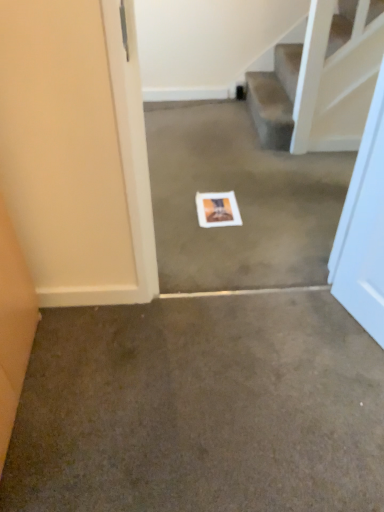
The image size is (384, 512). Describe the element at coordinates (200, 409) in the screenshot. I see `brown carpet at center, the 1th concrete from the bottom` at that location.

At what (x,y) coordinates should I click in order to perform the action: click on brown carpet at center, the 1th concrete viewed from the front. Please return your answer as a coordinate pair (x, y). This screenshot has width=384, height=512. Looking at the image, I should click on (200, 409).

Which is more distant, (215, 206) or (324, 201)?

Positioned behind is point (324, 201).

Considering the positions of objects white matte postcard at center and white paper at center, which is the first concrete in top-to-bottom order, in the image provided, who is more to the right, white matte postcard at center or white paper at center, which is the first concrete in top-to-bottom order,?

white paper at center, which is the first concrete in top-to-bottom order, is more to the right.

Based on the photo, considering the sizes of objects white matte postcard at center and white paper at center, positioned as the first concrete in back-to-front order, in the image provided, who is thinner, white matte postcard at center or white paper at center, positioned as the first concrete in back-to-front order,?

With smaller width is white matte postcard at center.

Locate an element on the screen. This screenshot has height=512, width=384. postcard below the white paper at center, which is the first concrete in top-to-bottom order (from the image's perspective) is located at coordinates (217, 209).

Who is shorter, white paper at center, the second concrete when ordered from front to back, or brown carpet at center, the 1th concrete viewed from the front?

brown carpet at center, the 1th concrete viewed from the front.

Looking at this image, from the image's perspective, is white paper at center, positioned as the first concrete in back-to-front order, under brown carpet at center, the 1th concrete viewed from the front?

Actually, white paper at center, positioned as the first concrete in back-to-front order, appears above brown carpet at center, the 1th concrete viewed from the front, in the image.

Does white paper at center, the second concrete when ordered from front to back, have a greater width compared to brown carpet at center, the 1th concrete viewed from the front?

Indeed, white paper at center, the second concrete when ordered from front to back, has a greater width compared to brown carpet at center, the 1th concrete viewed from the front.

What's the angular difference between brown carpet at center, arranged as the 2th concrete when viewed from the back, and white matte postcard at center's facing directions?

There is a 179-degree angle between the facing directions of brown carpet at center, arranged as the 2th concrete when viewed from the back, and white matte postcard at center.

Is brown carpet at center, arranged as the 2th concrete when viewed from the back, with white matte postcard at center?

No, brown carpet at center, arranged as the 2th concrete when viewed from the back, is not in contact with white matte postcard at center.

Which of these two, brown carpet at center, placed as the second concrete when sorted from top to bottom, or white matte postcard at center, stands taller?

brown carpet at center, placed as the second concrete when sorted from top to bottom.

Is brown carpet at center, the 1th concrete viewed from the front, outside of white matte postcard at center?

Yes, brown carpet at center, the 1th concrete viewed from the front, is not within white matte postcard at center.

Which point is more distant from viewer, (x=221, y=194) or (x=57, y=452)?

Positioned behind is point (x=221, y=194).

Considering the relative positions of white matte postcard at center and brown carpet at center, the 1th concrete viewed from the front, in the image provided, is white matte postcard at center to the left of brown carpet at center, the 1th concrete viewed from the front, from the viewer's perspective?

No.

Is white matte postcard at center shorter than brown carpet at center, placed as the second concrete when sorted from top to bottom?

Indeed, white matte postcard at center has a lesser height compared to brown carpet at center, placed as the second concrete when sorted from top to bottom.

Considering the relative sizes of white matte postcard at center and brown carpet at center, arranged as the 2th concrete when viewed from the back, in the image provided, is white matte postcard at center smaller than brown carpet at center, arranged as the 2th concrete when viewed from the back,?

Yes.

From the image's perspective, between brown carpet at center, the 1th concrete viewed from the front, and white paper at center, positioned as the first concrete in back-to-front order, which one is located above?

white paper at center, positioned as the first concrete in back-to-front order, from the image's perspective.

Is point (353, 422) closer or farther from the camera than point (200, 132)?

Point (353, 422) is closer to the camera than point (200, 132).

Does brown carpet at center, the 1th concrete viewed from the front, contain white paper at center, positioned as the first concrete in back-to-front order?

No, white paper at center, positioned as the first concrete in back-to-front order, is not a part of brown carpet at center, the 1th concrete viewed from the front.

Is brown carpet at center, the 1th concrete viewed from the front, with white paper at center, positioned as the first concrete in back-to-front order?

No, brown carpet at center, the 1th concrete viewed from the front, is not with white paper at center, positioned as the first concrete in back-to-front order.

Considering the sizes of objects white paper at center, positioned as the first concrete in back-to-front order, and white matte postcard at center in the image provided, who is wider, white paper at center, positioned as the first concrete in back-to-front order, or white matte postcard at center?

white paper at center, positioned as the first concrete in back-to-front order.

Which is more to the left, white paper at center, positioned as the first concrete in back-to-front order, or white matte postcard at center?

Positioned to the left is white matte postcard at center.

From the image's perspective, is white paper at center, which is the first concrete in top-to-bottom order, on white matte postcard at center?

Correct, white paper at center, which is the first concrete in top-to-bottom order, appears higher than white matte postcard at center in the image.

Looking at the image, does white paper at center, the 2th concrete ordered from the bottom, seem bigger or smaller compared to white matte postcard at center?

In the image, white paper at center, the 2th concrete ordered from the bottom, appears to be larger than white matte postcard at center.

At what (x,y) coordinates should I click in order to perform the action: click on postcard on the left of white paper at center, the 2th concrete ordered from the bottom. Please return your answer as a coordinate pair (x, y). The height and width of the screenshot is (512, 384). Looking at the image, I should click on (217, 209).

I want to click on concrete beneath the white paper at center, the second concrete when ordered from front to back (from a real-world perspective), so click(x=200, y=409).

Estimate the real-world distances between objects in this image. Which object is closer to brown carpet at center, the 1th concrete from the bottom, white matte postcard at center or white paper at center, which is the first concrete in top-to-bottom order?

white paper at center, which is the first concrete in top-to-bottom order, is closer to brown carpet at center, the 1th concrete from the bottom.

Considering their positions, is brown carpet at center, the 1th concrete from the bottom, positioned further to white paper at center, which is the first concrete in top-to-bottom order, than white matte postcard at center?

brown carpet at center, the 1th concrete from the bottom, is further to white paper at center, which is the first concrete in top-to-bottom order.

Estimate the real-world distances between objects in this image. Which object is further from white matte postcard at center, white paper at center, the 2th concrete ordered from the bottom, or brown carpet at center, placed as the second concrete when sorted from top to bottom?

brown carpet at center, placed as the second concrete when sorted from top to bottom, is further to white matte postcard at center.

Based on their spatial positions, is brown carpet at center, placed as the second concrete when sorted from top to bottom, or white paper at center, the 2th concrete ordered from the bottom, closer to white matte postcard at center?

The object closer to white matte postcard at center is white paper at center, the 2th concrete ordered from the bottom.

Looking at this image, when comparing their distances from white paper at center, positioned as the first concrete in back-to-front order, does white matte postcard at center or brown carpet at center, placed as the second concrete when sorted from top to bottom, seem further?

Among the two, brown carpet at center, placed as the second concrete when sorted from top to bottom, is located further to white paper at center, positioned as the first concrete in back-to-front order.

Which object lies further to the anchor point brown carpet at center, the 1th concrete from the bottom, white paper at center, the 2th concrete ordered from the bottom, or white matte postcard at center?

white matte postcard at center is further to brown carpet at center, the 1th concrete from the bottom.

Where is `postcard between white paper at center, positioned as the first concrete in back-to-front order, and brown carpet at center, arranged as the 2th concrete when viewed from the back, from top to bottom`? The image size is (384, 512). postcard between white paper at center, positioned as the first concrete in back-to-front order, and brown carpet at center, arranged as the 2th concrete when viewed from the back, from top to bottom is located at coordinates (217, 209).